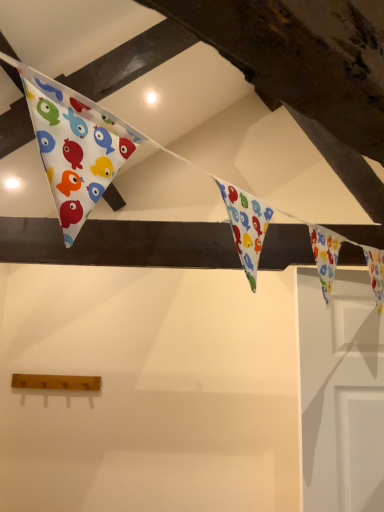
Measure the distance between brown wooden rack at lower left and camera.

A distance of 2.61 meters exists between brown wooden rack at lower left and camera.

This screenshot has width=384, height=512. What do you see at coordinates (56, 382) in the screenshot?
I see `brown wooden rack at lower left` at bounding box center [56, 382].

Identify the location of brown wooden rack at lower left. (56, 382).

Image resolution: width=384 pixels, height=512 pixels. What are the coordinates of `brown wooden rack at lower left` in the screenshot? It's located at (56, 382).